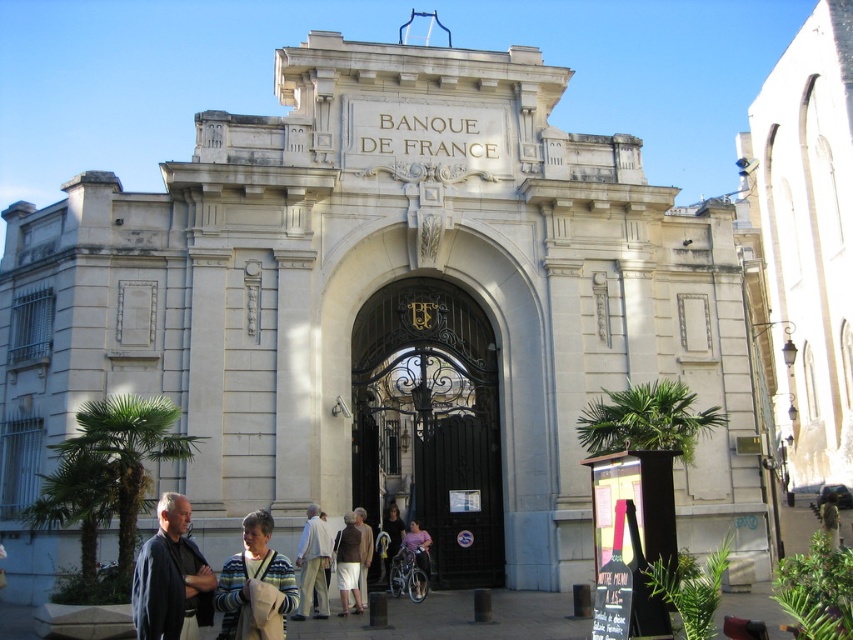
Question: Can you confirm if dark wrought iron gate at center is bigger than dark blue jacket at lower left?

Choices:
 (A) yes
 (B) no

Answer: (A)

Question: Which point is farther to the camera?

Choices:
 (A) click(x=339, y=572)
 (B) click(x=413, y=552)

Answer: (B)

Question: Which object is farther from the camera taking this photo?

Choices:
 (A) light pink fabric at center
 (B) dark blue jacket at lower left

Answer: (A)

Question: Which is nearer to the dark blue jacket at lower left?

Choices:
 (A) light brown fabric pants at center
 (B) dark wrought iron gate at center
 (C) striped sweater at center

Answer: (C)

Question: Does dark blue jacket at lower left have a smaller size compared to light pink fabric at center?

Choices:
 (A) yes
 (B) no

Answer: (B)

Question: Can you confirm if striped sweater at center is positioned below light pink fabric at center?

Choices:
 (A) no
 (B) yes

Answer: (A)